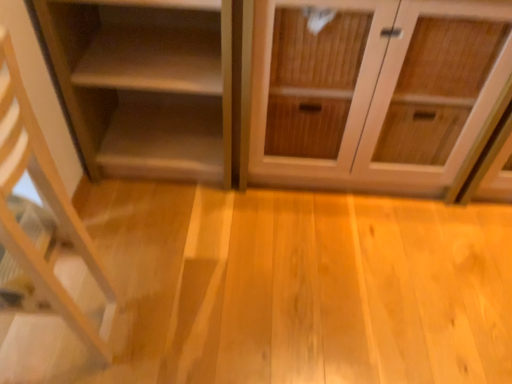
Question: Is light wood shelf at left, which appears as the 1th shelf when viewed from the front, oriented away from matte wood shelf at left, the second shelf from the front?

Choices:
 (A) yes
 (B) no

Answer: (B)

Question: Is light wood shelf at left, the 2th shelf positioned from the back, located outside matte wood shelf at left, the second shelf from the front?

Choices:
 (A) yes
 (B) no

Answer: (A)

Question: Is light wood shelf at left, the 2th shelf positioned from the back, at the right side of matte wood shelf at left, the second shelf from the front?

Choices:
 (A) no
 (B) yes

Answer: (A)

Question: Does light wood shelf at left, the 2th shelf positioned from the back, have a lesser height compared to matte wood shelf at left, positioned as the first shelf in back-to-front order?

Choices:
 (A) yes
 (B) no

Answer: (B)

Question: Is light wood shelf at left, which appears as the 1th shelf when viewed from the front, smaller than matte wood shelf at left, the second shelf from the front?

Choices:
 (A) no
 (B) yes

Answer: (A)

Question: Is light wood shelf at left, which appears as the 1th shelf when viewed from the front, positioned behind matte wood shelf at left, positioned as the first shelf in back-to-front order?

Choices:
 (A) no
 (B) yes

Answer: (A)

Question: Does wooden cabinet at center have a lesser height compared to light wood shelf at left, the 2th shelf positioned from the back?

Choices:
 (A) yes
 (B) no

Answer: (A)

Question: Is wooden cabinet at center completely or partially outside of light wood shelf at left, the 2th shelf positioned from the back?

Choices:
 (A) no
 (B) yes

Answer: (B)

Question: Is wooden cabinet at center surrounding light wood shelf at left, the 2th shelf positioned from the back?

Choices:
 (A) yes
 (B) no

Answer: (B)

Question: From the image's perspective, is wooden cabinet at center located beneath light wood shelf at left, the 2th shelf positioned from the back?

Choices:
 (A) no
 (B) yes

Answer: (A)

Question: Can you confirm if wooden cabinet at center is thinner than light wood shelf at left, the 2th shelf positioned from the back?

Choices:
 (A) yes
 (B) no

Answer: (B)

Question: Considering the relative sizes of wooden cabinet at center and light wood shelf at left, which appears as the 1th shelf when viewed from the front, in the image provided, is wooden cabinet at center wider than light wood shelf at left, which appears as the 1th shelf when viewed from the front,?

Choices:
 (A) no
 (B) yes

Answer: (B)

Question: Is matte wood shelf at left, positioned as the first shelf in back-to-front order, taller than light wood shelf at left, the 2th shelf positioned from the back?

Choices:
 (A) no
 (B) yes

Answer: (A)